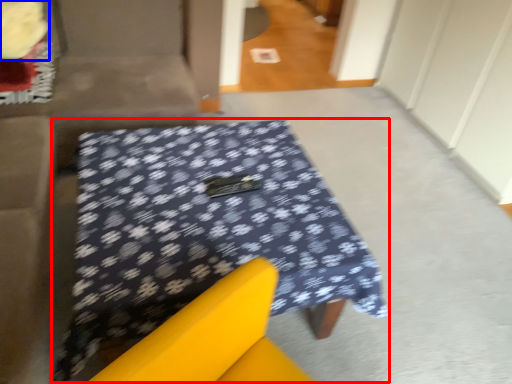
Question: Which object is further to the camera taking this photo, table (highlighted by a red box) or flower (highlighted by a blue box)?

Choices:
 (A) table
 (B) flower

Answer: (B)